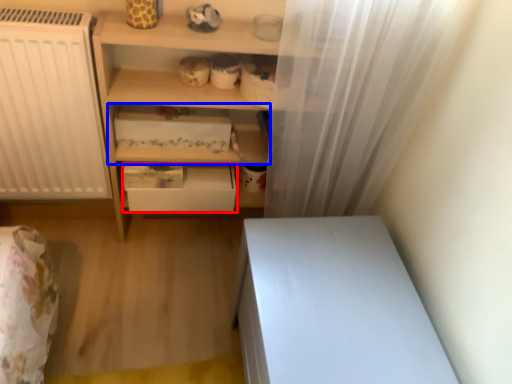
Question: Among these objects, which one is nearest to the camera, drawer (highlighted by a red box) or shelf (highlighted by a blue box)?

Choices:
 (A) drawer
 (B) shelf

Answer: (B)